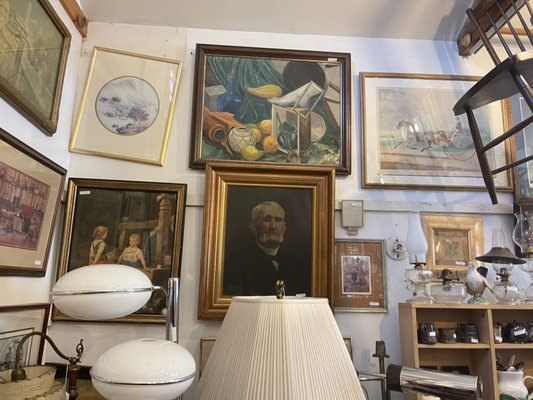
I want to click on temperature thermostat, so click(353, 214).